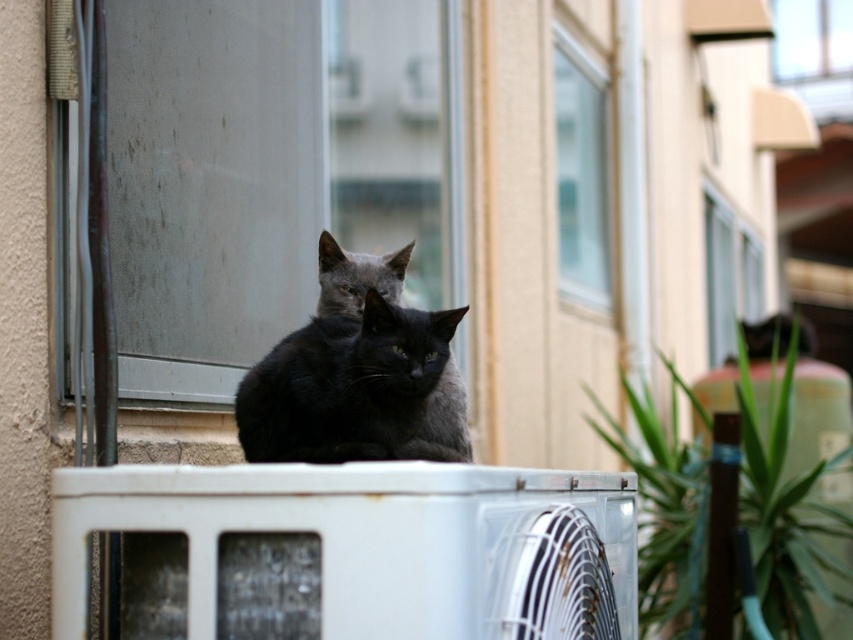
You are a photographer standing at a certain distance from the white metallic air conditioner at center. You want to take a close up photo of it. If your camera can focus on objects up to 4 feet away, will you be able to take a clear photo?

The white metallic air conditioner at center is 3.76 feet away from the camera. Since 3.76 feet is less than 4 feet, the camera can focus on it, so yes, you can take a clear photo.

You are a delivery drone with a wingspan of 20 inches. You need to fly through the space between the transparent glass window at upper center and the shiny black cat at center to deliver a package. Can you safely pass through this gap?

The transparent glass window at upper center and the shiny black cat at center are 23.51 inches apart from each other. Since your wingspan is 20 inches, which is narrower than the gap, you can safely pass through the space between them.

In the scene shown: You are a photographer aiming to capture both the shiny black cat at center and the gray cat behind it in a single focused shot. Given that your camera can only sharply focus on objects within a 0.3 unit radius from a chosen point, what is the best coordinate to set your focus to ensure both cats are in focus?

The best coordinate to set the focus would be the midpoint between the shiny black cat at center and the gray cat behind it. Since the shiny black cat at center is at point (358, 374), and the gray cat is behind it, the midpoint would ensure both are within the 0.3 unit radius, keeping both cats in focus.